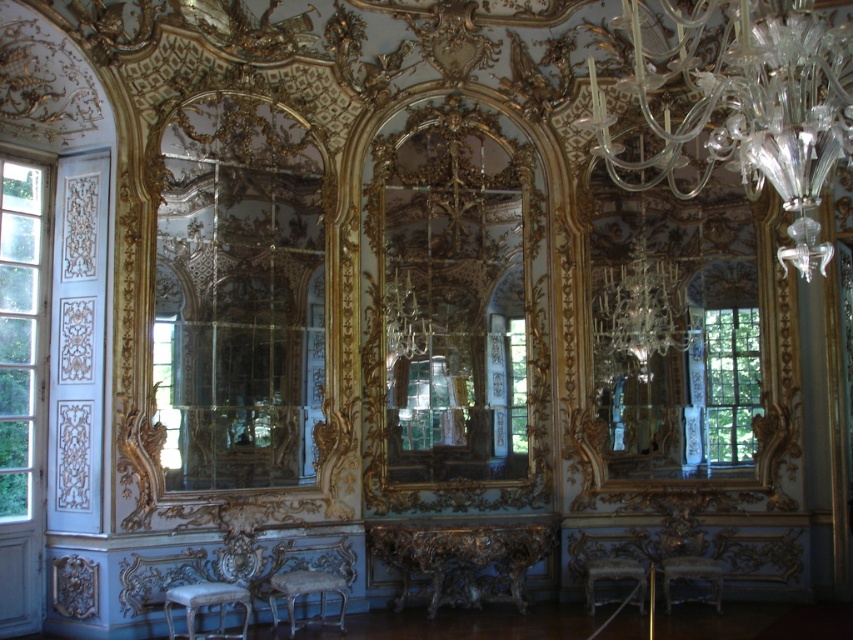
Between clear glass chandelier at upper right and white fabric stool at center, which one is positioned lower?

white fabric stool at center

Who is positioned more to the left, clear glass chandelier at upper right or white fabric stool at center?

clear glass chandelier at upper right is more to the left.

Where is `clear glass chandelier at upper right`? The image size is (853, 640). clear glass chandelier at upper right is located at coordinates tap(741, 106).

Does silver metallic stool at lower center appear on the right side of wooden polished stool at lower center?

Incorrect, silver metallic stool at lower center is not on the right side of wooden polished stool at lower center.

Can you confirm if silver metallic stool at lower center is thinner than wooden polished stool at lower center?

No, silver metallic stool at lower center is not thinner than wooden polished stool at lower center.

Which is in front, point (218, 593) or point (621, 561)?

Point (218, 593)

Locate an element on the screen. silver metallic stool at lower center is located at coordinates (206, 604).

Locate an element on the screen. This screenshot has height=640, width=853. silver metallic chair at lower left is located at coordinates (218, 588).

The image size is (853, 640). I want to click on silver metallic chair at lower left, so click(218, 588).

You are a GUI agent. You are given a task and a screenshot of the screen. Output one action in this format:
    pyautogui.click(x=<x>, y=<y>)
    Task: Click on the silver metallic chair at lower left
    This screenshot has height=640, width=853.
    Given the screenshot: What is the action you would take?
    pyautogui.click(x=218, y=588)